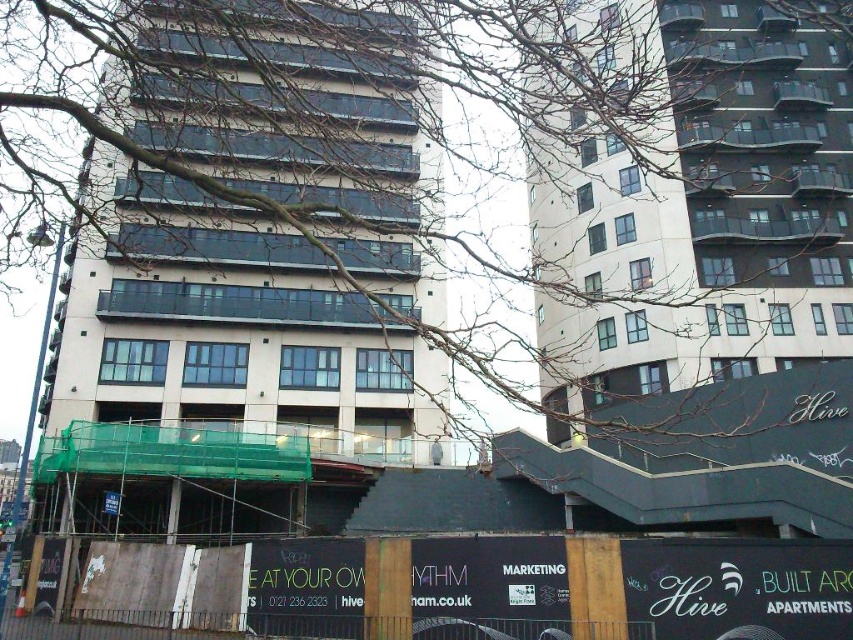
You are a crane operator trying to lift a heavy beam. You need to place it between the beige concrete building at left and the smooth concrete building at upper center. Can you fit the beam between them without hitting either building?

The beige concrete building at left is in front of the smooth concrete building at upper center, so there is no space between them. The beam cannot be placed between them without hitting at least one of the buildings.

You are a construction worker planning to install a new safety net between the beige concrete building at left and the smooth concrete building at upper center. Based on their positions, which building is lower and closer to the ground?

The beige concrete building at left is located below the smooth concrete building at upper center, so it is the lower and closer to the ground of the two.

Based on the scene description, which building has a greater width between the beige concrete building at left and the smooth concrete building at upper center?

The beige concrete building at left has a greater width than the smooth concrete building at upper center according to the description.